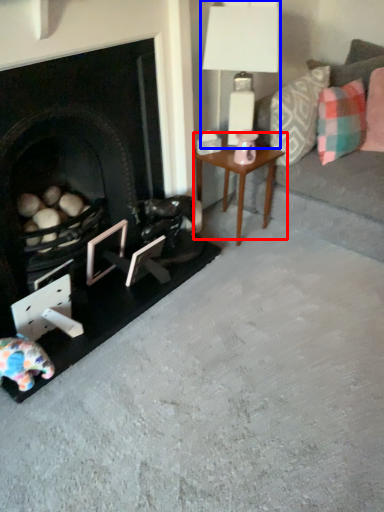
Question: Which point is further to the camera, table (highlighted by a red box) or table lamp (highlighted by a blue box)?

Choices:
 (A) table
 (B) table lamp

Answer: (A)